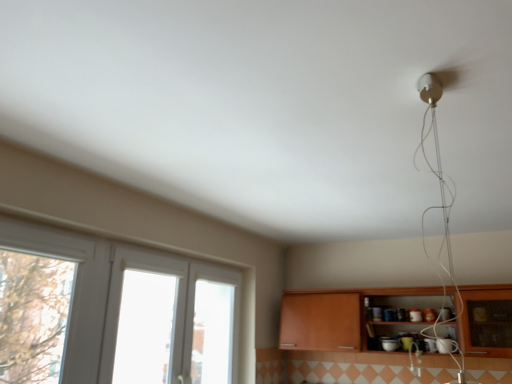
Question: Can you confirm if white plastic window at left is bigger than wooden cabinet at lower right?

Choices:
 (A) no
 (B) yes

Answer: (A)

Question: Is white plastic window at left facing away from wooden cabinet at lower right?

Choices:
 (A) no
 (B) yes

Answer: (A)

Question: Is white plastic window at left taller than wooden cabinet at lower right?

Choices:
 (A) yes
 (B) no

Answer: (A)

Question: Is white plastic window at left further to the viewer compared to wooden cabinet at lower right?

Choices:
 (A) no
 (B) yes

Answer: (A)

Question: Could wooden cabinet at lower right be considered to be inside white plastic window at left?

Choices:
 (A) yes
 (B) no

Answer: (B)

Question: Is white plastic window at left outside wooden cabinet at lower right?

Choices:
 (A) yes
 (B) no

Answer: (A)

Question: Does wooden cabinet at lower right have a smaller size compared to white plastic window at left?

Choices:
 (A) yes
 (B) no

Answer: (B)

Question: Is wooden cabinet at lower right bigger than white plastic window at left?

Choices:
 (A) yes
 (B) no

Answer: (A)

Question: Is wooden cabinet at lower right not inside white plastic window at left?

Choices:
 (A) no
 (B) yes

Answer: (B)

Question: From the image's perspective, is wooden cabinet at lower right below white plastic window at left?

Choices:
 (A) no
 (B) yes

Answer: (B)

Question: Is wooden cabinet at lower right oriented away from white plastic window at left?

Choices:
 (A) no
 (B) yes

Answer: (A)

Question: Can you confirm if wooden cabinet at lower right is positioned to the right of white plastic window at left?

Choices:
 (A) no
 (B) yes

Answer: (B)

Question: Which is correct: wooden cabinet at lower right is inside white plastic window at left, or outside of it?

Choices:
 (A) outside
 (B) inside

Answer: (A)